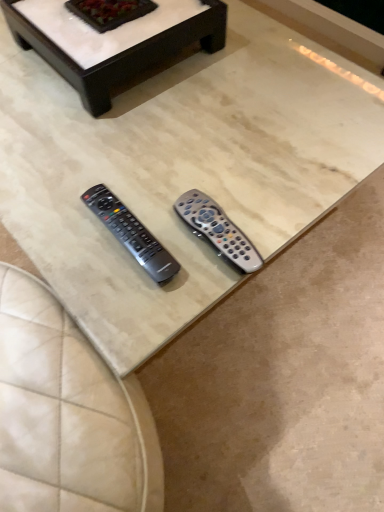
Identify the location of empty space that is to the right of white marble coffee table at upper center, which ranks as the first coffee table in back-to-front order. (262, 68).